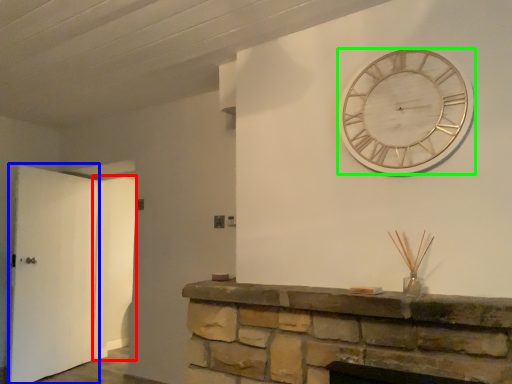
Question: Estimate the real-world distances between objects in this image. Which object is farther from door (highlighted by a red box), door (highlighted by a blue box) or wall clock (highlighted by a green box)?

Choices:
 (A) door
 (B) wall clock

Answer: (B)